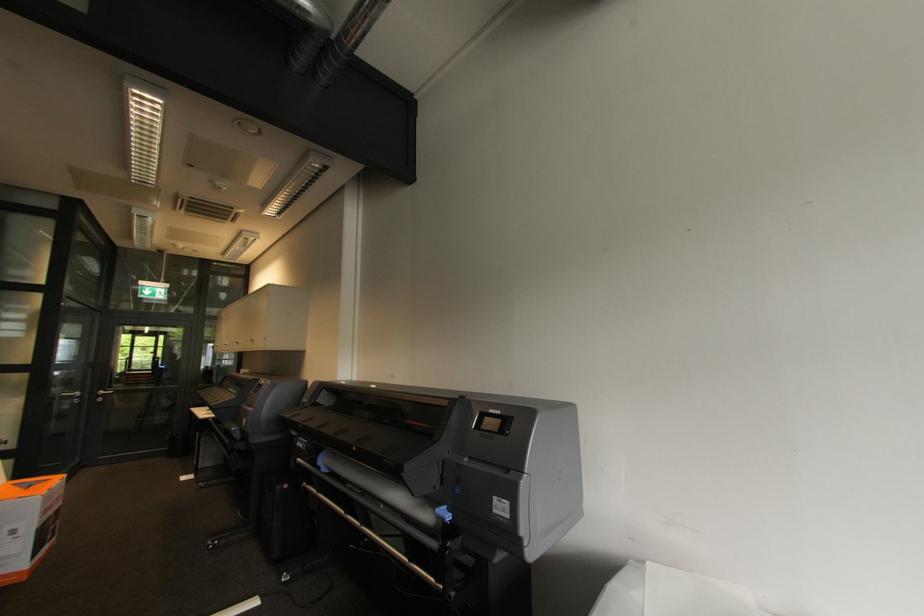
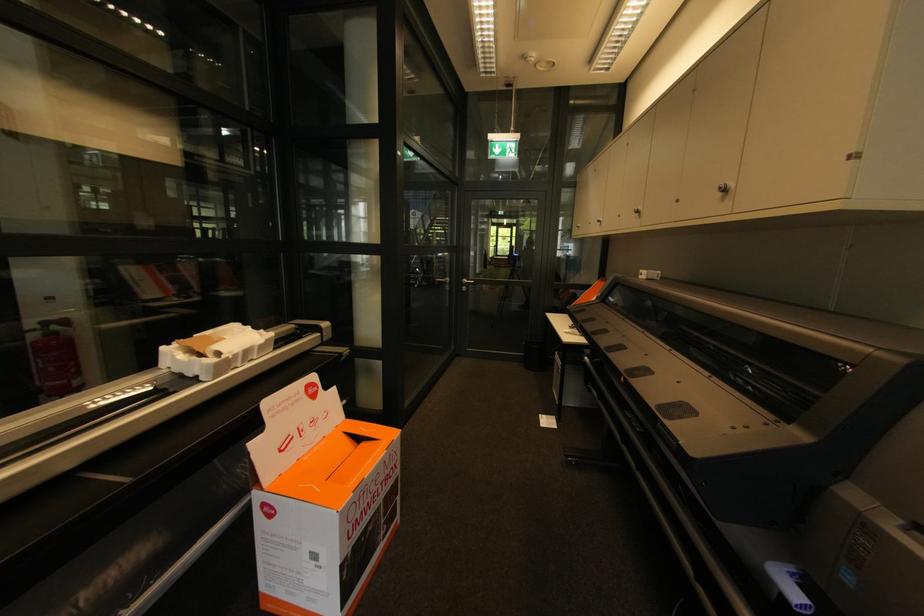
In the second image, find the point that corresponds to point (256, 342) in the first image.

(727, 191)